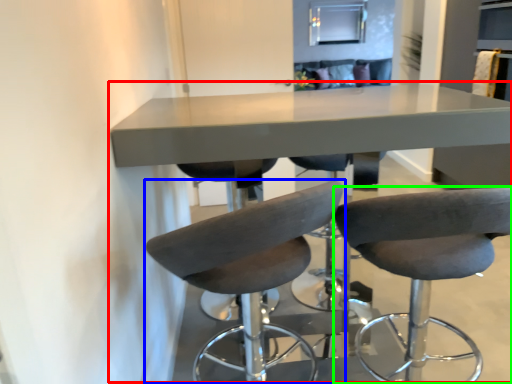
Question: Which object is positioned closest to table (highlighted by a red box)? Select from chair (highlighted by a blue box) and chair (highlighted by a green box).

Choices:
 (A) chair
 (B) chair

Answer: (A)